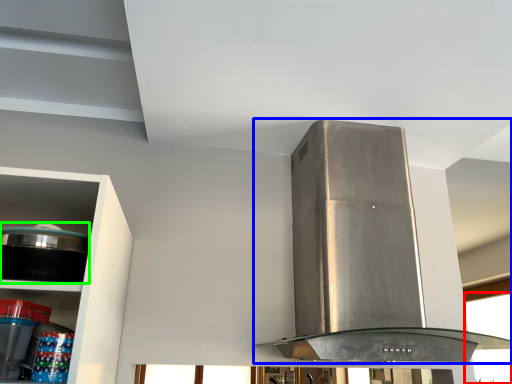
Question: Which is nearer to the window (highlighted by a red box)? home appliance (highlighted by a blue box) or appliance (highlighted by a green box).

Choices:
 (A) home appliance
 (B) appliance

Answer: (A)